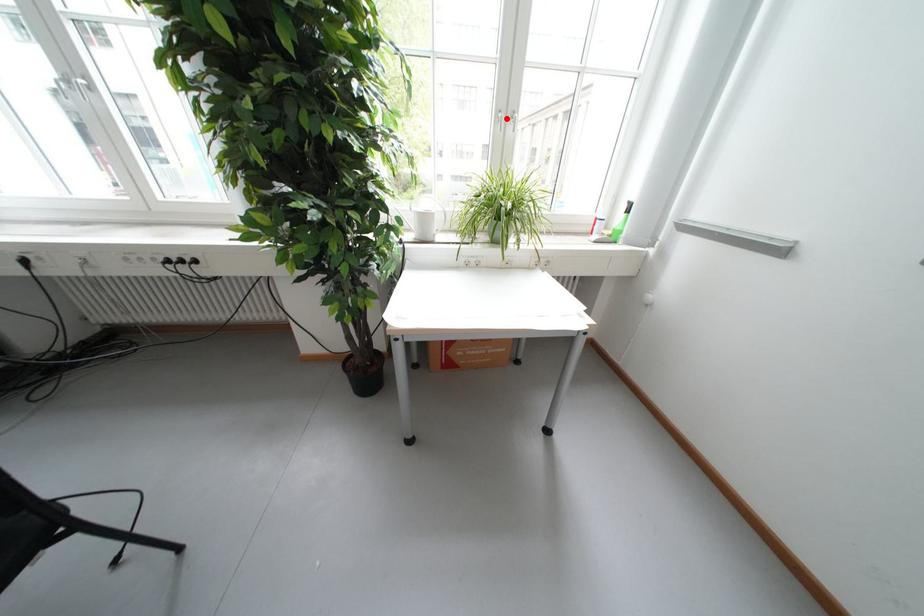
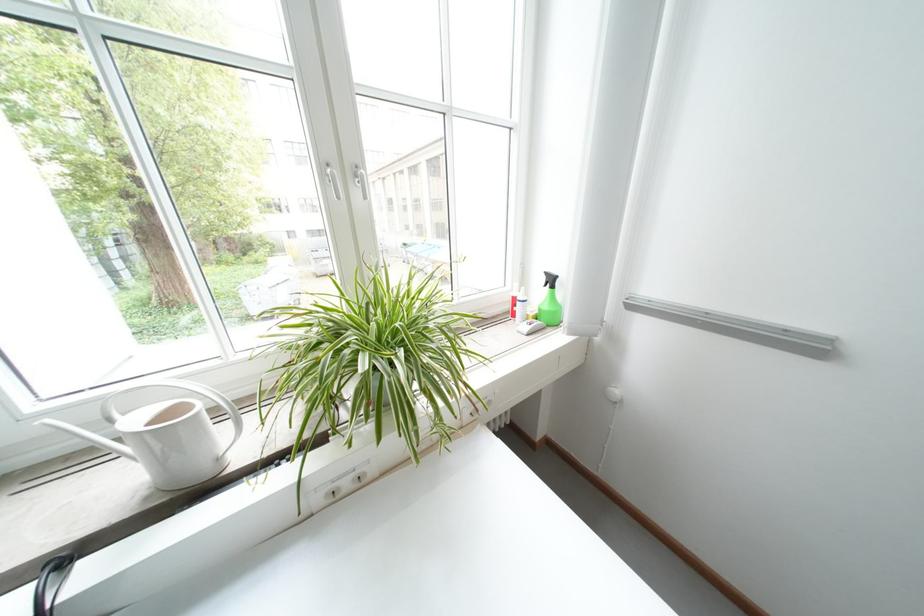
In the second image, find the point that corresponds to the highlighted location in the first image.

(333, 175)